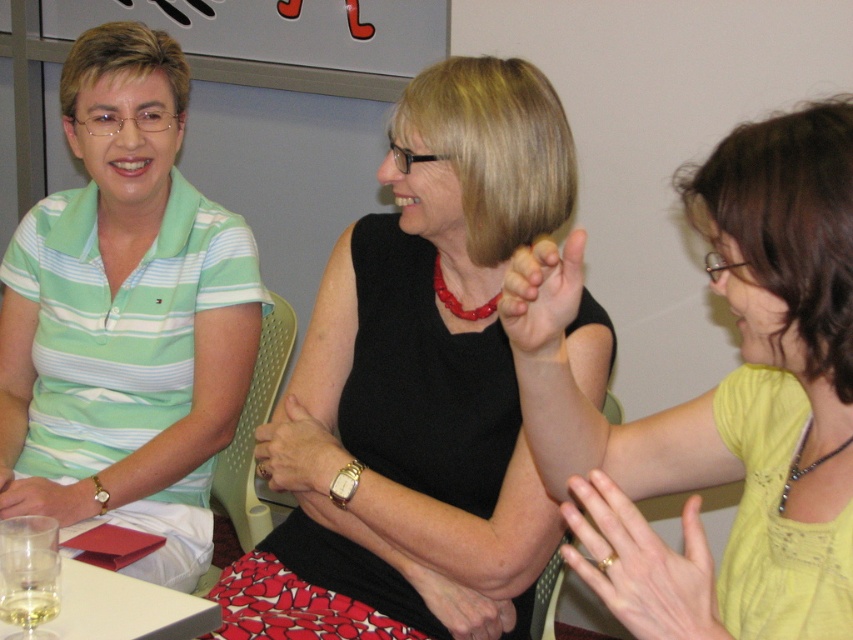
Question: Which point appears closest to the camera in this image?

Choices:
 (A) (746, 636)
 (B) (346, 284)
 (C) (102, 628)
 (D) (531, 252)

Answer: (A)

Question: Is yellow matte shirt at upper right positioned in front of clear glass wine glass at lower left?

Choices:
 (A) no
 (B) yes

Answer: (B)

Question: Which point is closer to the camera?

Choices:
 (A) (465, 611)
 (B) (112, 518)

Answer: (A)

Question: Can you confirm if gold metallic ring at upper right is thinner than white glossy table at lower left?

Choices:
 (A) no
 (B) yes

Answer: (B)

Question: Can you confirm if white glossy table at lower left is thinner than smooth skin hand at center?

Choices:
 (A) yes
 (B) no

Answer: (B)

Question: Which of the following is the farthest from the observer?

Choices:
 (A) black matte dress at center
 (B) green striped polo shirt at left
 (C) clear glass wine glass at lower left
 (D) smooth red necklace at center

Answer: (B)